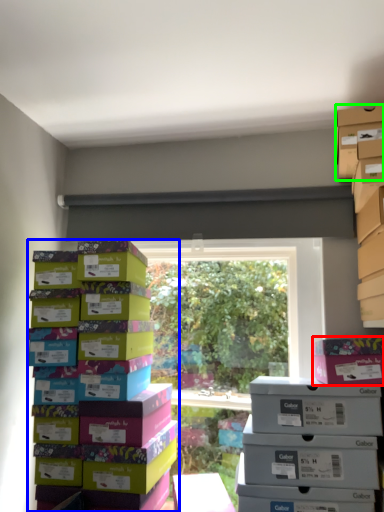
Question: Which object is positioned closest to cardboard box (highlighted by a red box)? Select from box (highlighted by a blue box) and storage box (highlighted by a green box).

Choices:
 (A) box
 (B) storage box

Answer: (B)